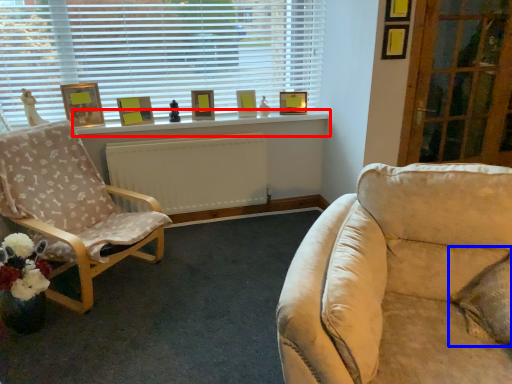
Question: Which of the following is the farthest to the observer, window sill (highlighted by a red box) or pillow (highlighted by a blue box)?

Choices:
 (A) window sill
 (B) pillow

Answer: (A)